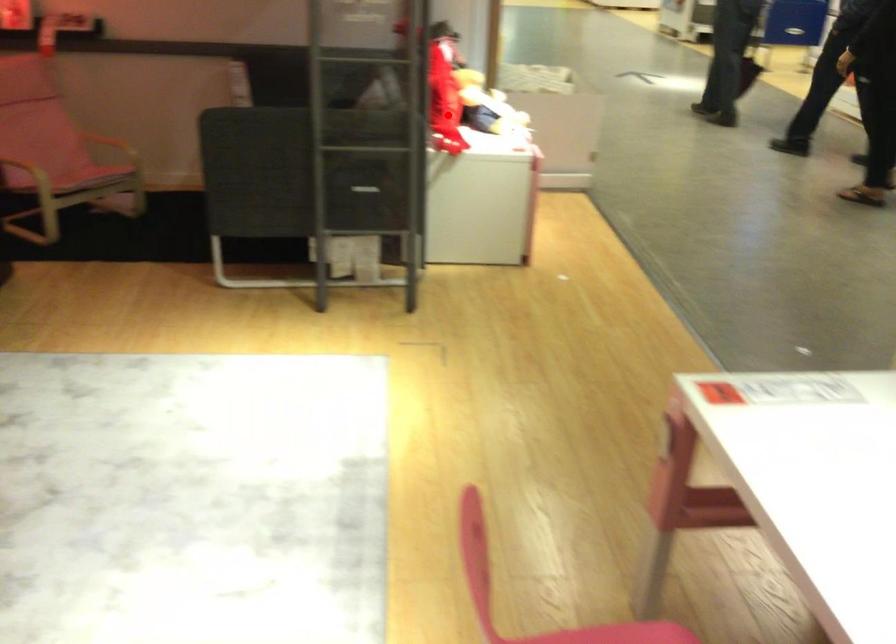
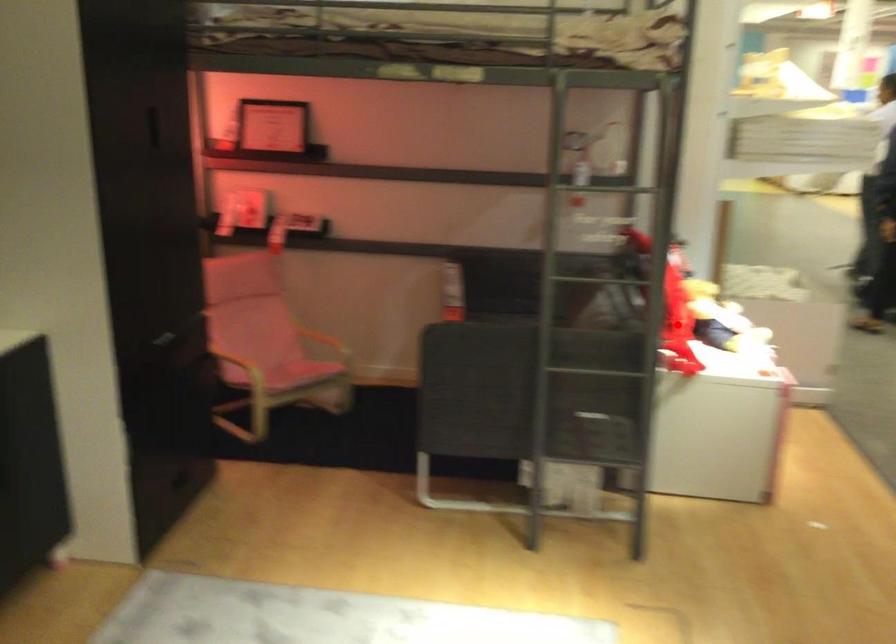
I am providing you with two images of the same scene from different viewpoints. A red point is marked on the first image and another point is marked on the second image. Is the red point in image1 aligned with the point shown in image2?

Yes